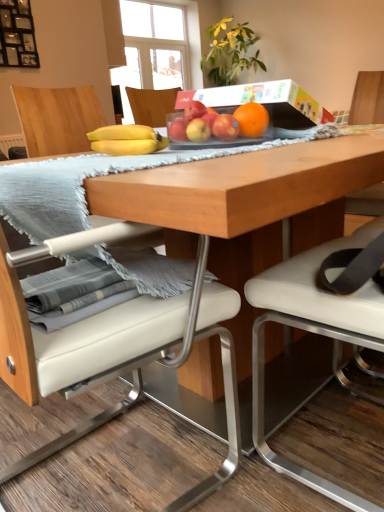
Identify the location of yellow matte apple at center, the 3th apple when ordered from left to right. This screenshot has height=512, width=384. (198, 130).

Find the location of a particular element. The height and width of the screenshot is (512, 384). red matte apple at center, placed as the second apple when sorted from left to right is located at coordinates (194, 110).

Measure the distance between yellow matte bananas at center and camera.

A distance of 37.11 inches exists between yellow matte bananas at center and camera.

The width and height of the screenshot is (384, 512). Identify the location of white leather chair at center, positioned as the first chair in right-to-left order. (313, 332).

Image resolution: width=384 pixels, height=512 pixels. What do you see at coordinates (137, 361) in the screenshot? I see `white leather chair at center, placed as the second chair when sorted from right to left` at bounding box center [137, 361].

Image resolution: width=384 pixels, height=512 pixels. Find the location of `red matte apple at center, the 4th apple from the left`. red matte apple at center, the 4th apple from the left is located at coordinates (225, 127).

Describe the element at coordinates (225, 127) in the screenshot. I see `red matte apple at center, the 4th apple from the left` at that location.

What is the approximate width of orange matte at center?

It is 2.66 inches.

Describe the element at coordinates (178, 129) in the screenshot. Image resolution: width=384 pixels, height=512 pixels. I see `red matte apple at center, the 1th apple positioned from the left` at that location.

This screenshot has height=512, width=384. Find the location of `yellow matte apple at center, the 3th apple when ordered from left to right`. yellow matte apple at center, the 3th apple when ordered from left to right is located at coordinates (198, 130).

Does red matte apple at center, the 1th apple positioned from the left, have a greater width compared to white leather chair at center, positioned as the first chair in right-to-left order?

No.

Is white leather chair at center, the second chair in the left-to-right sequence, located within red matte apple at center, the 1th apple positioned from the left?

No, white leather chair at center, the second chair in the left-to-right sequence, is located outside of red matte apple at center, the 1th apple positioned from the left.

Is red matte apple at center, the 1th apple positioned from the left, bigger or smaller than white leather chair at center, the second chair in the left-to-right sequence?

In the image, red matte apple at center, the 1th apple positioned from the left, appears to be smaller than white leather chair at center, the second chair in the left-to-right sequence.

What's the angular difference between yellow matte apple at center, the 3th apple when ordered from left to right, and white leather chair at center, marked as the 1th chair in a left-to-right arrangement,'s facing directions?

They differ by 179 degrees in their facing directions.

This screenshot has height=512, width=384. In order to click on the 2nd chair below when counting from the yellow matte apple at center, the 3th apple when ordered from left to right (from the image's perspective) in this screenshot , I will do `click(137, 361)`.

Does yellow matte apple at center, the 3th apple when ordered from left to right, lie in front of white leather chair at center, placed as the second chair when sorted from right to left?

No, yellow matte apple at center, the 3th apple when ordered from left to right, is behind white leather chair at center, placed as the second chair when sorted from right to left.

Does yellow matte apple at center, the 3th apple when ordered from left to right, have a greater width compared to white leather chair at center, placed as the second chair when sorted from right to left?

No, yellow matte apple at center, the 3th apple when ordered from left to right, is not wider than white leather chair at center, placed as the second chair when sorted from right to left.

Is red matte apple at center, placed as the second apple when sorted from left to right, placed right next to white leather chair at center, positioned as the first chair in right-to-left order?

red matte apple at center, placed as the second apple when sorted from left to right, is not next to white leather chair at center, positioned as the first chair in right-to-left order, and they're not touching.

Which object is further away from the camera, red matte apple at center, placed as the second apple when sorted from left to right, or white leather chair at center, the second chair in the left-to-right sequence?

red matte apple at center, placed as the second apple when sorted from left to right, is behind.

From the image's perspective, which one is positioned lower, red matte apple at center, placed as the second apple when sorted from left to right, or white leather chair at center, the second chair in the left-to-right sequence?

white leather chair at center, the second chair in the left-to-right sequence, is shown below in the image.

At what (x,y) coordinates should I click in order to perform the action: click on the 3rd apple counting from the left of the white leather chair at center, positioned as the first chair in right-to-left order. Please return your answer as a coordinate pair (x, y). This screenshot has width=384, height=512. Looking at the image, I should click on (194, 110).

Considering the sizes of objects yellow matte apple at center, the 3th apple when ordered from left to right, and orange matte at center in the image provided, who is bigger, yellow matte apple at center, the 3th apple when ordered from left to right, or orange matte at center?

orange matte at center is bigger.

Who is taller, yellow matte apple at center, the 3th apple when ordered from left to right, or orange matte at center?

→ Standing taller between the two is orange matte at center.

Consider the image. Could you tell me if yellow matte apple at center, which is counted as the 2th apple, starting from the right, is facing orange matte at center?

No, yellow matte apple at center, which is counted as the 2th apple, starting from the right, is not oriented towards orange matte at center.

From a real-world perspective, between yellow matte apple at center, which is counted as the 2th apple, starting from the right, and orange matte at center, who is vertically lower?

In real-world perspective, yellow matte apple at center, which is counted as the 2th apple, starting from the right, is lower.

Which object is more forward, yellow matte apple at center, the 3th apple when ordered from left to right, or red matte apple at center, the 1th apple positioned from the left?

yellow matte apple at center, the 3th apple when ordered from left to right, is closer to the camera.

Is yellow matte apple at center, the 3th apple when ordered from left to right, facing away from red matte apple at center, acting as the 4th apple starting from the right?

yellow matte apple at center, the 3th apple when ordered from left to right, does not have its back to red matte apple at center, acting as the 4th apple starting from the right.

From the picture: From a real-world perspective, who is located lower, yellow matte apple at center, the 3th apple when ordered from left to right, or red matte apple at center, the 1th apple positioned from the left?

red matte apple at center, the 1th apple positioned from the left.

Between yellow matte apple at center, which is counted as the 2th apple, starting from the right, and red matte apple at center, arranged as the third apple when viewed from the right, which one has less height?

With less height is yellow matte apple at center, which is counted as the 2th apple, starting from the right.

Between yellow matte apple at center, the 3th apple when ordered from left to right, and red matte apple at center, arranged as the third apple when viewed from the right, which one has larger width?

With larger width is red matte apple at center, arranged as the third apple when viewed from the right.

Does point (189, 127) come behind point (188, 106)?

No.

Between yellow matte apple at center, the 3th apple when ordered from left to right, and red matte apple at center, placed as the second apple when sorted from left to right, which one appears on the left side from the viewer's perspective?

From the viewer's perspective, red matte apple at center, placed as the second apple when sorted from left to right, appears more on the left side.

Is white leather chair at center, placed as the second chair when sorted from right to left, shorter than red matte apple at center, acting as the 4th apple starting from the right?

No.

Is white leather chair at center, placed as the second chair when sorted from right to left, placed right next to red matte apple at center, the 1th apple positioned from the left?

No, white leather chair at center, placed as the second chair when sorted from right to left, is not beside red matte apple at center, the 1th apple positioned from the left.

Is white leather chair at center, marked as the 1th chair in a left-to-right arrangement, aimed at red matte apple at center, acting as the 4th apple starting from the right?

Yes, white leather chair at center, marked as the 1th chair in a left-to-right arrangement, is facing red matte apple at center, acting as the 4th apple starting from the right.

At what (x,y) coordinates should I click in order to perform the action: click on the 1st chair below the red matte apple at center, acting as the 4th apple starting from the right (from the image's perspective). Please return your answer as a coordinate pair (x, y). This screenshot has width=384, height=512. Looking at the image, I should click on (313, 332).

The height and width of the screenshot is (512, 384). I want to click on chair that is the 2nd object located in front of the yellow matte apple at center, the 3th apple when ordered from left to right, so click(137, 361).

Estimate the real-world distances between objects in this image. Which object is closer to orange matte at center, yellow matte apple at center, which is counted as the 2th apple, starting from the right, or white leather chair at center, the second chair in the left-to-right sequence?

yellow matte apple at center, which is counted as the 2th apple, starting from the right, lies closer to orange matte at center than the other object.

Based on their spatial positions, is red matte apple at center, the 4th apple from the left, or white leather chair at center, marked as the 1th chair in a left-to-right arrangement, closer to yellow matte bananas at center?

red matte apple at center, the 4th apple from the left, is positioned closer to the anchor yellow matte bananas at center.

From the image, which object appears to be farther from white leather chair at center, placed as the second chair when sorted from right to left, orange matte at center or yellow matte apple at center, which is counted as the 2th apple, starting from the right?

orange matte at center is positioned further to the anchor white leather chair at center, placed as the second chair when sorted from right to left.

Looking at the image, which one is located closer to yellow matte bananas at center, white leather chair at center, the second chair in the left-to-right sequence, or red matte apple at center, the 4th apple from the left?

The object closer to yellow matte bananas at center is red matte apple at center, the 4th apple from the left.

From the picture: Based on their spatial positions, is red matte apple at center, acting as the 4th apple starting from the right, or orange matte at center further from white leather chair at center, positioned as the first chair in right-to-left order?

Based on the image, red matte apple at center, acting as the 4th apple starting from the right, appears to be further to white leather chair at center, positioned as the first chair in right-to-left order.

From the image, which object appears to be farther from yellow matte apple at center, the 3th apple when ordered from left to right, yellow matte bananas at center or red matte apple at center, acting as the 4th apple starting from the right?

Based on the image, yellow matte bananas at center appears to be further to yellow matte apple at center, the 3th apple when ordered from left to right.

Estimate the real-world distances between objects in this image. Which object is further from yellow matte apple at center, which is counted as the 2th apple, starting from the right, white leather chair at center, the second chair in the left-to-right sequence, or red matte apple at center, the 1th apple positioned from the left?

The object further to yellow matte apple at center, which is counted as the 2th apple, starting from the right, is white leather chair at center, the second chair in the left-to-right sequence.

Which object lies further to the anchor point red matte apple at center, placed as the second apple when sorted from left to right, white leather chair at center, marked as the 1th chair in a left-to-right arrangement, or white leather chair at center, positioned as the first chair in right-to-left order?

white leather chair at center, marked as the 1th chair in a left-to-right arrangement, is further to red matte apple at center, placed as the second apple when sorted from left to right.

Where is `banana located between white leather chair at center, placed as the second chair when sorted from right to left, and yellow matte apple at center, the 3th apple when ordered from left to right, in the depth direction`? banana located between white leather chair at center, placed as the second chair when sorted from right to left, and yellow matte apple at center, the 3th apple when ordered from left to right, in the depth direction is located at coordinates pyautogui.click(x=126, y=140).

Find the location of a particular element. The width and height of the screenshot is (384, 512). apple located between yellow matte apple at center, the 3th apple when ordered from left to right, and orange matte at center in the left-right direction is located at coordinates (225, 127).

Where is `apple between white leather chair at center, placed as the second chair when sorted from right to left, and orange matte at center, along the z-axis`? The image size is (384, 512). apple between white leather chair at center, placed as the second chair when sorted from right to left, and orange matte at center, along the z-axis is located at coordinates (225, 127).

This screenshot has height=512, width=384. In order to click on chair positioned between white leather chair at center, placed as the second chair when sorted from right to left, and orange matte at center from near to far in this screenshot , I will do `click(313, 332)`.